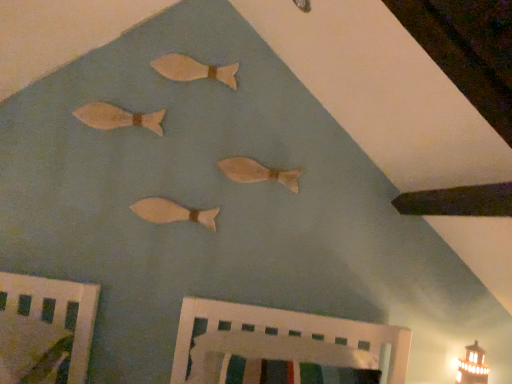
Question: Could wooden bed frame at lower left, the second furniture when ordered from right to left, be considered to be inside wooden fish at upper center, which appears as the fourth fish when ordered from the bottom?

Choices:
 (A) no
 (B) yes

Answer: (A)

Question: From the image's perspective, would you say wooden fish at upper center, which is counted as the first fish, starting from the top, is positioned over wooden bed frame at lower left, the second furniture when ordered from right to left?

Choices:
 (A) yes
 (B) no

Answer: (A)

Question: Does wooden fish at upper center, which is counted as the first fish, starting from the top, have a lesser height compared to wooden bed frame at lower left, which is counted as the first furniture, starting from the left?

Choices:
 (A) yes
 (B) no

Answer: (A)

Question: Does wooden fish at upper center, which is counted as the first fish, starting from the top, have a smaller size compared to wooden bed frame at lower left, the second furniture when ordered from right to left?

Choices:
 (A) no
 (B) yes

Answer: (B)

Question: Does wooden fish at upper center, which is counted as the first fish, starting from the top, have a greater width compared to wooden bed frame at lower left, the second furniture when ordered from right to left?

Choices:
 (A) yes
 (B) no

Answer: (B)

Question: Choose the correct answer: Is white painted wood crib at lower center, the second furniture from the left, inside matte wooden fish at center, which ranks as the third fish in top-to-bottom order, or outside it?

Choices:
 (A) outside
 (B) inside

Answer: (A)

Question: From the image's perspective, is white painted wood crib at lower center, marked as the 1th furniture in a right-to-left arrangement, positioned above or below matte wooden fish at center, which ranks as the third fish in top-to-bottom order?

Choices:
 (A) above
 (B) below

Answer: (B)

Question: Would you say white painted wood crib at lower center, marked as the 1th furniture in a right-to-left arrangement, is to the left or to the right of matte wooden fish at center, which ranks as the third fish in top-to-bottom order, in the picture?

Choices:
 (A) right
 (B) left

Answer: (A)

Question: Considering the positions of white painted wood crib at lower center, marked as the 1th furniture in a right-to-left arrangement, and matte wooden fish at center, which ranks as the third fish in top-to-bottom order, in the image, is white painted wood crib at lower center, marked as the 1th furniture in a right-to-left arrangement, taller or shorter than matte wooden fish at center, which ranks as the third fish in top-to-bottom order,?

Choices:
 (A) short
 (B) tall

Answer: (B)

Question: Considering the positions of wooden fish at upper left, acting as the third fish starting from the bottom, and white painted wood crib at lower center, marked as the 1th furniture in a right-to-left arrangement, in the image, is wooden fish at upper left, acting as the third fish starting from the bottom, taller or shorter than white painted wood crib at lower center, marked as the 1th furniture in a right-to-left arrangement,?

Choices:
 (A) short
 (B) tall

Answer: (A)

Question: From the image's perspective, is wooden fish at upper left, acting as the third fish starting from the bottom, located above or below white painted wood crib at lower center, the second furniture from the left?

Choices:
 (A) below
 (B) above

Answer: (B)

Question: Relative to white painted wood crib at lower center, the second furniture from the left, is wooden fish at upper left, acting as the third fish starting from the bottom, in front or behind?

Choices:
 (A) behind
 (B) front

Answer: (A)

Question: From a real-world perspective, is wooden fish at upper left, acting as the third fish starting from the bottom, physically located above or below white painted wood crib at lower center, marked as the 1th furniture in a right-to-left arrangement?

Choices:
 (A) below
 (B) above

Answer: (B)

Question: Is point (366, 322) closer or farther from the camera than point (156, 115)?

Choices:
 (A) farther
 (B) closer

Answer: (A)

Question: Considering the positions of white painted wood crib at lower center, the second furniture from the left, and wooden fish at upper left, which appears as the second fish when viewed from the top, in the image, is white painted wood crib at lower center, the second furniture from the left, bigger or smaller than wooden fish at upper left, which appears as the second fish when viewed from the top,?

Choices:
 (A) big
 (B) small

Answer: (A)